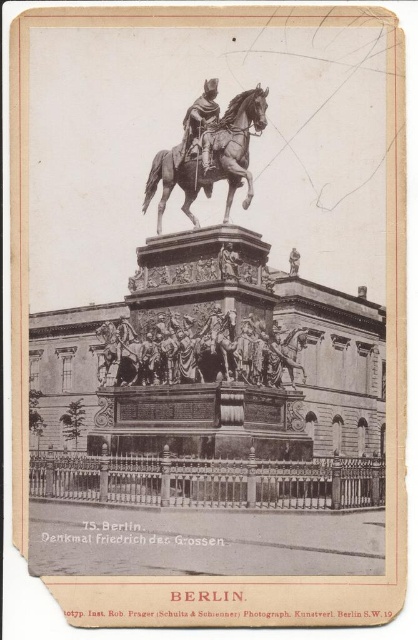
Question: Considering the relative positions of polished bronze horse at center and bronze statue at center in the image provided, where is polished bronze horse at center located with respect to bronze statue at center?

Choices:
 (A) left
 (B) right

Answer: (B)

Question: Is polished bronze horse at center smaller than bronze statue at center?

Choices:
 (A) yes
 (B) no

Answer: (A)

Question: Which point appears closest to the camera in this image?

Choices:
 (A) (209, 90)
 (B) (191, 176)

Answer: (B)

Question: Which point is farther to the camera?

Choices:
 (A) bronze statue at center
 (B) polished bronze horse at center

Answer: (A)

Question: Can you confirm if polished bronze horse at center is wider than bronze statue at center?

Choices:
 (A) yes
 (B) no

Answer: (A)